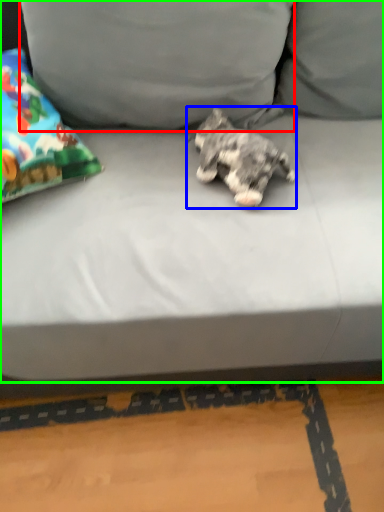
Question: Based on their relative distances, which object is nearer to pillow (highlighted by a red box)? Choose from dog (highlighted by a blue box) and studio couch (highlighted by a green box).

Choices:
 (A) dog
 (B) studio couch

Answer: (B)